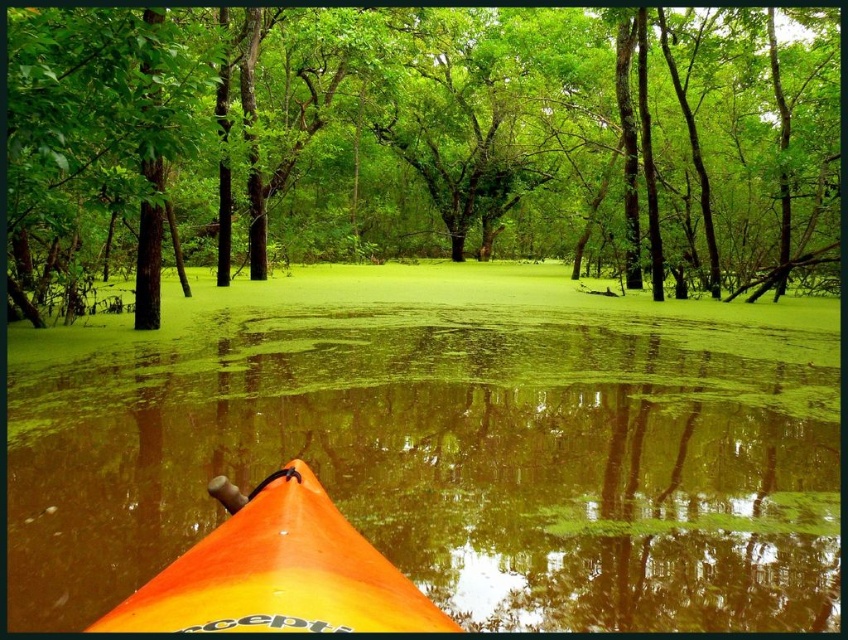
You are navigating a kayak through a swamp and see a green leafy tree at center. If you want to reach the tree, should you adjust your direction to the left or right?

The green leafy tree at center is located at coordinates point (421,140), so you should adjust your direction to the left to reach it.

You are a kayaker planning to navigate through the swamp. You see the orange kayak at lower center and the orange plastic kayak at lower center ahead. The minimum safe distance required between kayaks in this swamp is 10 feet. Can you safely pass between them?

The distance between the orange kayak at lower center and the orange plastic kayak at lower center is 10.97 feet, which is greater than the minimum safe distance of 10 feet. Therefore, you can safely pass between them.

You are navigating a kayak through a swamp and want to position your orange kayak at lower center exactly at point 0.695, 0.528. What coordinates should you aim for?

The orange kayak at lower center should be positioned at coordinates (447, 444).